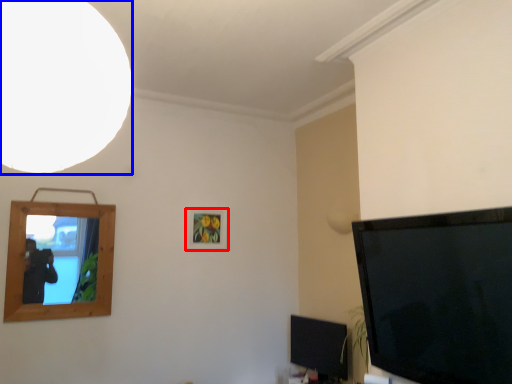
Question: Which object is further to the camera taking this photo, picture frame (highlighted by a red box) or light (highlighted by a blue box)?

Choices:
 (A) picture frame
 (B) light

Answer: (A)